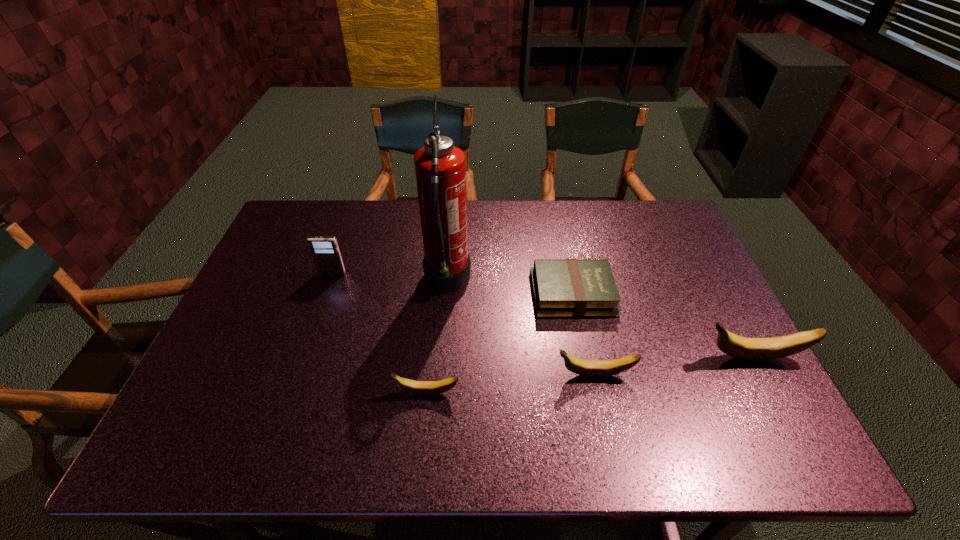
Point out which banana is positioned as the second nearest to the third shortest object. Please provide its 2D coordinates. Your answer should be formatted as a tuple, i.e. [(x, y)], where the tuple contains the x and y coordinates of a point satisfying the conditions above.

[(416, 387)]

I want to click on free spot that satisfies the following two spatial constraints: 1. on the front-facing side of the fire extinguisher; 2. on the left side of the shortest object, so click(446, 294).

Locate an element on the screen. The image size is (960, 540). free space that satisfies the following two spatial constraints: 1. on the front-facing side of the book; 2. on the left side of the iPod is located at coordinates (324, 294).